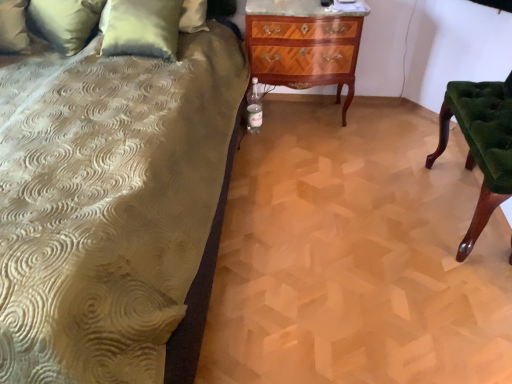
You are a GUI agent. You are given a task and a screenshot of the screen. Output one action in this format:
    pyautogui.click(x=<x>, y=<y>)
    Task: Click on the free space between mahogany wood chest of drawers at center and green velvet chair at right
    The width and height of the screenshot is (512, 384).
    Given the screenshot: What is the action you would take?
    pyautogui.click(x=376, y=151)